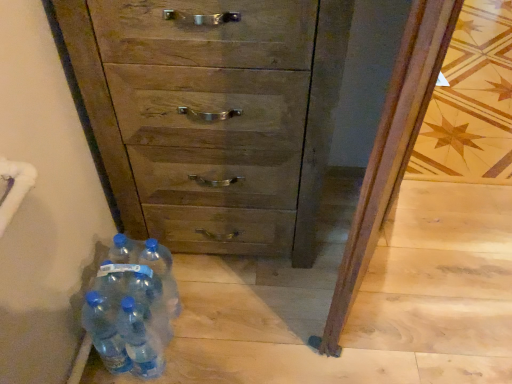
The image size is (512, 384). What are the coordinates of `free spot in front of wooden chest of drawers at center` in the screenshot? It's located at (243, 318).